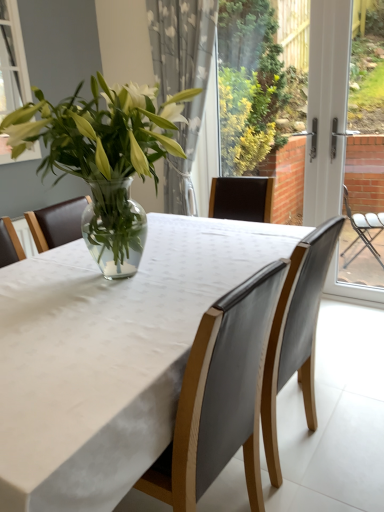
Find the location of `vacant space to the right of leather chair at center, the 1th chair in the right-to-left sequence`. vacant space to the right of leather chair at center, the 1th chair in the right-to-left sequence is located at coordinates (354, 441).